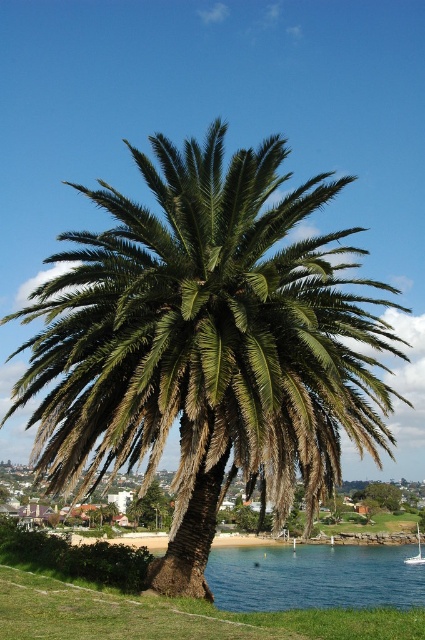
Question: Is green leafy palm tree at center further to the viewer compared to green leafy palm at center?

Choices:
 (A) yes
 (B) no

Answer: (B)

Question: Which of these objects is positioned closest to the white glossy sailboat at lower right?

Choices:
 (A) green leafy palm at center
 (B) green leafy palm tree at center

Answer: (A)

Question: In this image, where is green leafy palm at center located relative to white glossy sailboat at lower right?

Choices:
 (A) below
 (B) above

Answer: (B)

Question: Does green leafy palm at center have a larger size compared to white glossy sailboat at lower right?

Choices:
 (A) no
 (B) yes

Answer: (A)

Question: Estimate the real-world distances between objects in this image. Which object is closer to the green leafy palm tree at center?

Choices:
 (A) white glossy sailboat at lower right
 (B) green leafy palm at center

Answer: (B)

Question: Which point is farther to the camera?

Choices:
 (A) (136, 515)
 (B) (70, 472)
 (C) (419, 564)

Answer: (A)